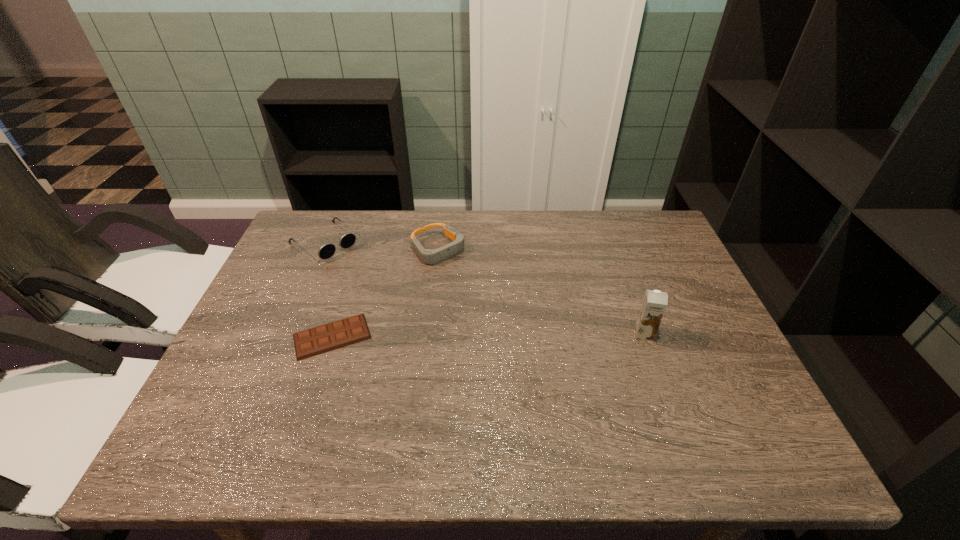
At what (x,y) coordinates should I click in order to perform the action: click on the shortest object. Please return your answer as a coordinate pair (x, y). This screenshot has height=540, width=960. Looking at the image, I should click on (311, 342).

Locate an element on the screen. the rightmost object is located at coordinates (654, 304).

This screenshot has height=540, width=960. In order to click on the tallest object in this screenshot , I will do `click(654, 304)`.

The width and height of the screenshot is (960, 540). Identify the location of the third object from left to right. (x=430, y=256).

Identify the location of sunglasses. The image size is (960, 540). (327, 250).

Where is `vacant space positioned 0.160m on the back of the chocolate bar`? vacant space positioned 0.160m on the back of the chocolate bar is located at coordinates (352, 273).

I want to click on vacant area situated 0.070m on the front of the chocolate milk, so click(x=655, y=366).

The width and height of the screenshot is (960, 540). What are the coordinates of `vacant position located 0.350m on the front and back of the second object from right to left` in the screenshot? It's located at (533, 336).

The height and width of the screenshot is (540, 960). Find the location of `free space located 0.130m on the front and back of the second object from right to left`. free space located 0.130m on the front and back of the second object from right to left is located at coordinates (479, 287).

Find the location of a particular element. This screenshot has width=960, height=540. free space located on the front and back of the second object from right to left is located at coordinates (512, 317).